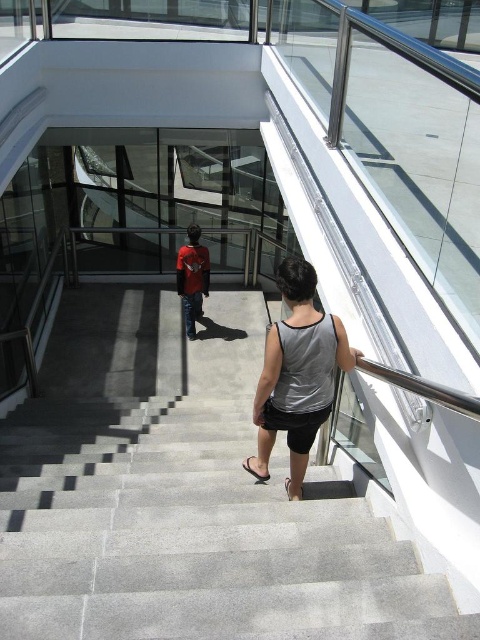
Is gray concrete stairs at center shorter than gray fabric tank top at center?

Yes, gray concrete stairs at center is shorter than gray fabric tank top at center.

Is point (33, 596) positioned in front of point (300, 492)?

That is True.

Does point (188, 384) come farther from viewer compared to point (277, 426)?

Yes, point (188, 384) is farther from viewer.

I want to click on gray concrete stairs at center, so click(183, 497).

Who is shorter, gray fabric tank top at center or red shirt at center?

With less height is gray fabric tank top at center.

Identify the location of gray fabric tank top at center. The width and height of the screenshot is (480, 640). (297, 374).

Is gray concrete stairs at center above red shirt at center?

No.

Which is above, gray concrete stairs at center or red shirt at center?

red shirt at center

Is point (181, 540) in front of point (204, 278)?

That is True.

At what (x,y) coordinates should I click in order to perform the action: click on gray concrete stairs at center. Please return your answer as a coordinate pair (x, y). This screenshot has width=480, height=640. Looking at the image, I should click on (183, 497).